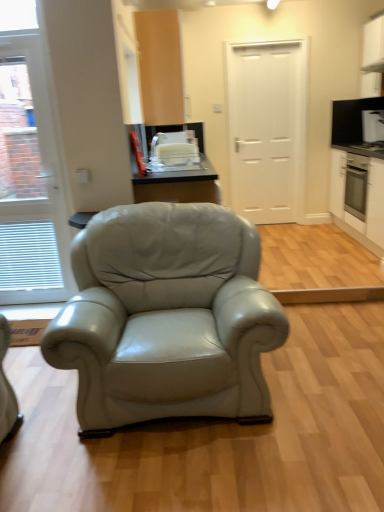
Question: Considering the relative positions of white glossy cabinet at right, which is the 3th cabinetry in left-to-right order, and white glossy door at left, the 1th door from the left, in the image provided, is white glossy cabinet at right, which is the 3th cabinetry in left-to-right order, to the left of white glossy door at left, the 1th door from the left, from the viewer's perspective?

Choices:
 (A) no
 (B) yes

Answer: (A)

Question: From the image's perspective, is white glossy cabinet at right, which is the 3th cabinetry in left-to-right order, above white glossy door at left, the 1th door from the left?

Choices:
 (A) yes
 (B) no

Answer: (A)

Question: Is white glossy cabinet at right, the 1th cabinetry positioned from the right, next to white glossy door at left, the 2th door viewed from the right?

Choices:
 (A) yes
 (B) no

Answer: (B)

Question: Considering the relative sizes of white glossy cabinet at right, which is the 3th cabinetry in left-to-right order, and white glossy door at left, placed as the first door when sorted from front to back, in the image provided, is white glossy cabinet at right, which is the 3th cabinetry in left-to-right order, wider than white glossy door at left, placed as the first door when sorted from front to back,?

Choices:
 (A) yes
 (B) no

Answer: (A)

Question: Is white glossy cabinet at right, the 1th cabinetry positioned from the right, taller than white glossy door at left, placed as the first door when sorted from front to back?

Choices:
 (A) yes
 (B) no

Answer: (B)

Question: Can you confirm if white glossy cabinet at right, the 1th cabinetry positioned from the right, is smaller than white glossy door at left, marked as the 2th door in a back-to-front arrangement?

Choices:
 (A) yes
 (B) no

Answer: (B)

Question: From the image's perspective, is white glossy microwave at upper right, the 2th appliance positioned from the front, located beneath white glossy cabinet at right, which is the 3th cabinetry in left-to-right order?

Choices:
 (A) yes
 (B) no

Answer: (B)

Question: Is white glossy microwave at upper right, the 2th appliance positioned from the front, to the left of white glossy cabinet at right, which is the 3th cabinetry in left-to-right order, from the viewer's perspective?

Choices:
 (A) no
 (B) yes

Answer: (A)

Question: Could you tell me if white glossy microwave at upper right, which ranks as the first appliance in top-to-bottom order, is turned towards white glossy cabinet at right, which is the 3th cabinetry in left-to-right order?

Choices:
 (A) no
 (B) yes

Answer: (A)

Question: Is white glossy cabinet at right, the 1th cabinetry positioned from the right, surrounded by white glossy microwave at upper right, which ranks as the first appliance in top-to-bottom order?

Choices:
 (A) no
 (B) yes

Answer: (A)

Question: From a real-world perspective, is white glossy microwave at upper right, the 2th appliance in the left-to-right sequence, beneath white glossy cabinet at right, the 1th cabinetry positioned from the right?

Choices:
 (A) yes
 (B) no

Answer: (B)

Question: Is white glossy microwave at upper right, the 2th appliance in the left-to-right sequence, positioned behind white glossy cabinet at right, the 1th cabinetry positioned from the right?

Choices:
 (A) yes
 (B) no

Answer: (A)

Question: Does white glossy microwave at upper right, which ranks as the first appliance in top-to-bottom order, appear on the left side of white matte door at center, acting as the second door starting from the front?

Choices:
 (A) yes
 (B) no

Answer: (B)